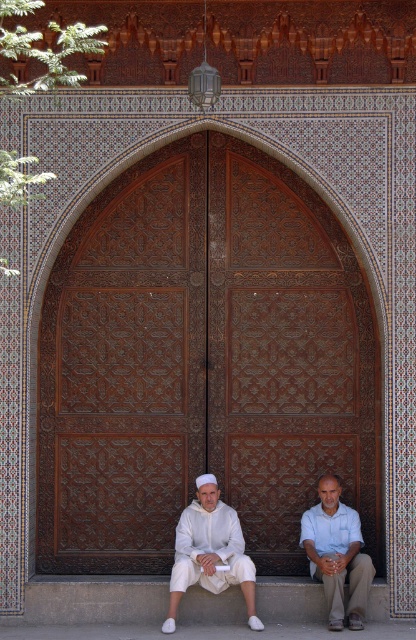
You are a fashion designer observing the image and need to determine the arrangement of the white matte clothing at lower center and the white cotton shirt at lower center. Which one is positioned higher up?

The white matte clothing at lower center is taller than white cotton shirt at lower center, so the white matte clothing at lower center is positioned higher up.

You are standing in front of the wooden door and want to take a photo of the point at coordinates point [56,422]. If your camera has a maximum focusing range of 25 meters, will it be able to focus on that point?

The distance of point [56,422] from the camera is 27.06 meters, which exceeds the camera maximum focusing range of 25 meters. Therefore, the camera cannot focus on that point.

You are a photographer trying to capture the decorative wall and its door. You notice two items in the scene that might distract from the main subject. Which item is closer to the camera, potentially causing more distraction? Please refer to the white cotton clothing at center and the white cotton shirt at lower center.

The white cotton clothing at center is closer to the camera because the white cotton shirt at lower center is behind it, making the clothing at center more likely to distract.